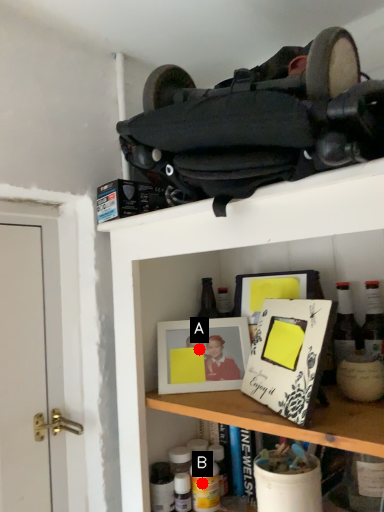
Question: Two points are circled on the image, labeled by A and B beside each circle. Which point is farther to the camera?

Choices:
 (A) A is further
 (B) B is further

Answer: (A)